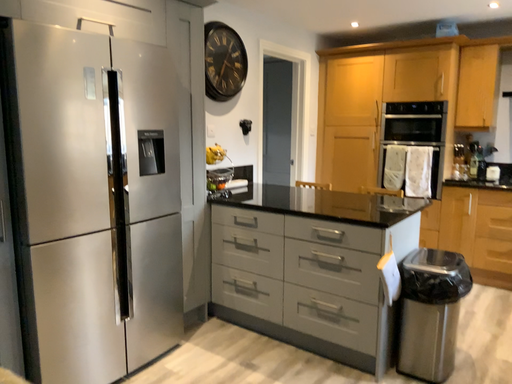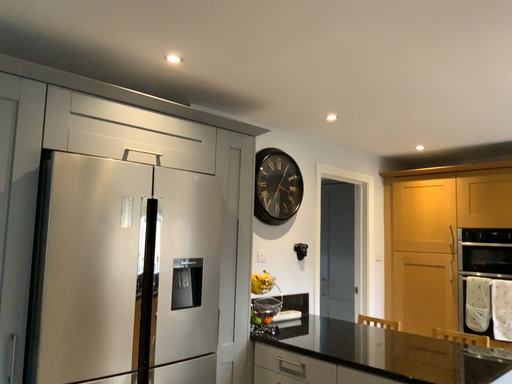
Question: Which way did the camera rotate in the video?

Choices:
 (A) rotated left
 (B) rotated right

Answer: (A)